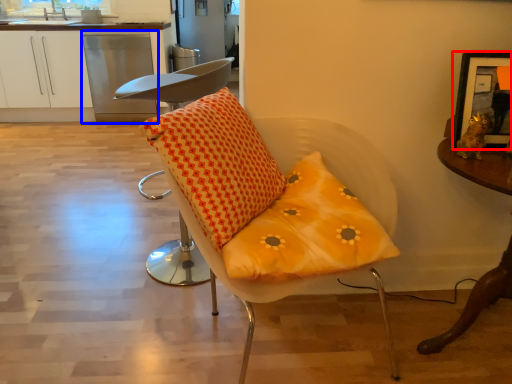
Question: Which of the following is the closest to the observer, picture frame (highlighted by a red box) or dish washer (highlighted by a blue box)?

Choices:
 (A) picture frame
 (B) dish washer

Answer: (A)